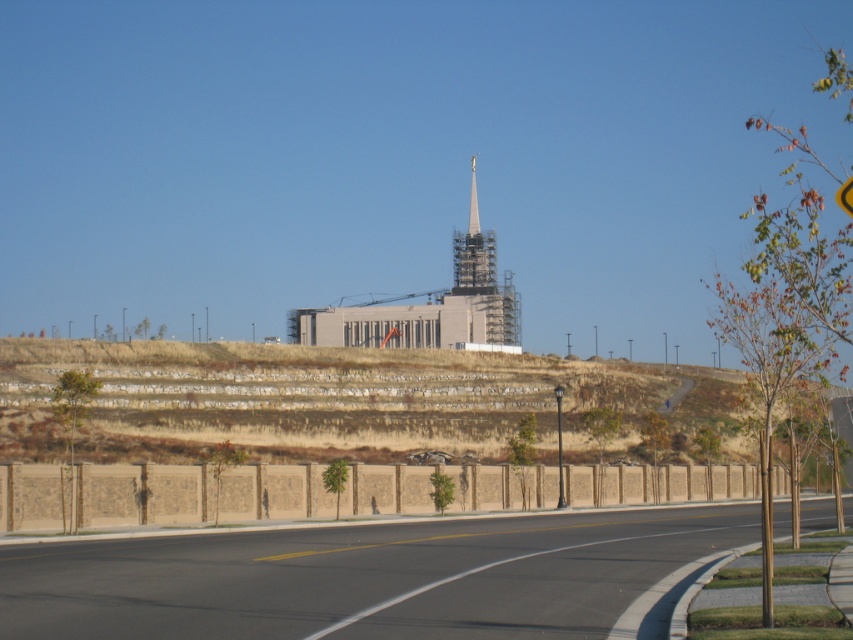
You are standing at the base of the sloped hill where the temple under construction is located. You want to reach the asphalt road at center. Which direction should you walk to get there from your current position?

The asphalt road at center is located at point coordinates, so you should walk towards the center of the scene to reach it.

You are standing at the base of the temple construction site. You see two points marked on the slope of the hill. The first point is at coordinates point (309, 355) and the second is at point (476, 276). Which point is closer to you?

Point (309, 355) is in front of point (476, 276), so it is closer to you.

You are a construction worker needing to transport a 10m wide equipment trailer through the asphalt road at center. The trailer requires a minimum clearance of 5m to pass under the white metallic spire at center. Can the trailer safely pass through the road and under the spire?

The asphalt road at center is wider than the white metallic spire at center. However, the spire is 5m tall and the trailer requires a minimum clearance of 5m to pass under it. Since the spire is exactly 5m tall, the trailer can just barely pass under it if aligned properly, but there is a risk of collision if not precise.